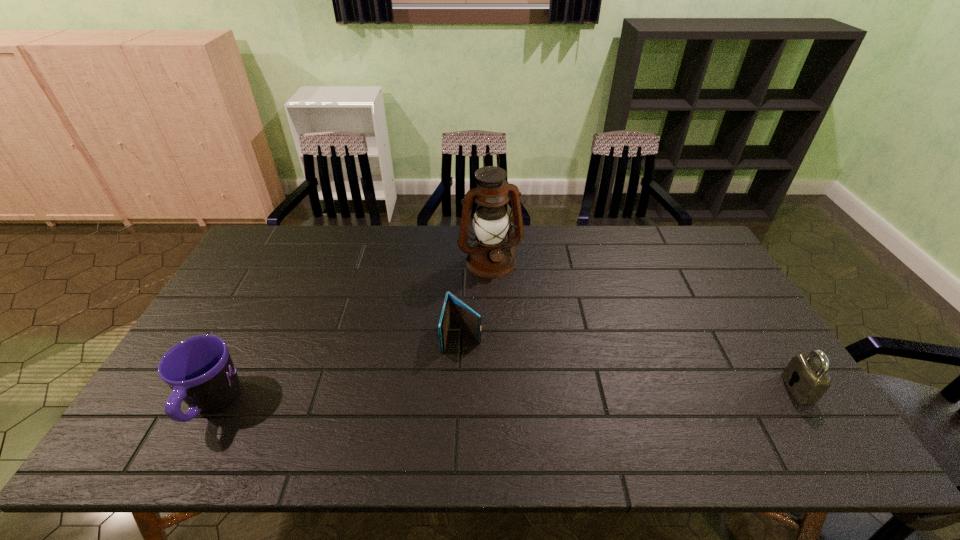
Where is `vacant space located on the side of the lantern, there is a wick adjustment knob`? The image size is (960, 540). vacant space located on the side of the lantern, there is a wick adjustment knob is located at coordinates (537, 367).

Locate an element on the screen. This screenshot has height=540, width=960. vacant space located 0.190m on the side of the lantern, there is a wick adjustment knob is located at coordinates (516, 319).

Find the location of a particular element. vacant space located on the exterior surface of the shortest object is located at coordinates (450, 394).

The image size is (960, 540). Identify the location of free region located on the exterior surface of the shortest object. (451, 391).

Identify the location of free space located 0.070m on the exterior surface of the shortest object. (454, 375).

Where is `object that is at the far edge`? This screenshot has height=540, width=960. object that is at the far edge is located at coordinates (490, 256).

This screenshot has height=540, width=960. I want to click on mug situated at the near edge, so click(x=200, y=371).

The height and width of the screenshot is (540, 960). Identify the location of padlock at the near edge. pyautogui.click(x=810, y=381).

Locate an element on the screen. The image size is (960, 540). object positioned at the left edge is located at coordinates (200, 371).

I want to click on object situated at the right edge, so click(x=810, y=381).